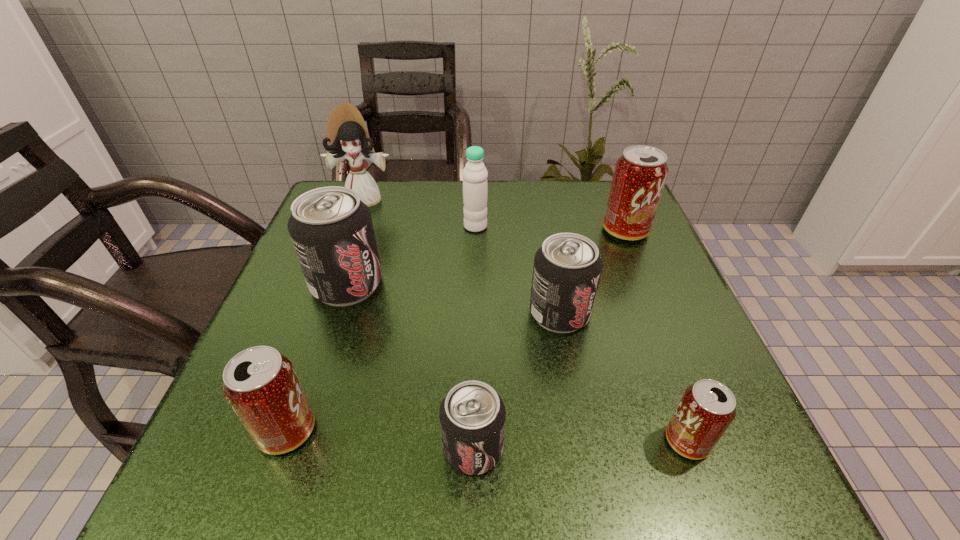
The width and height of the screenshot is (960, 540). Find the location of `free spot at the left edge of the desktop`. free spot at the left edge of the desktop is located at coordinates (209, 432).

In the image, there is a desktop. What are the coordinates of `blank space at the right edge` in the screenshot? It's located at (749, 424).

You are a GUI agent. You are given a task and a screenshot of the screen. Output one action in this format:
    pyautogui.click(x=<x>, y=<y>)
    Task: Click on the free point between the smallest black soda can and the leftmost red soda can
    
    Given the screenshot: What is the action you would take?
    pyautogui.click(x=380, y=440)

The height and width of the screenshot is (540, 960). Identify the location of free space that is in between the white water bottle and the fourth soda can from left to right. (517, 270).

Find the location of a particular element. free spot between the smallest red soda can and the second black soda can from left to right is located at coordinates (580, 444).

The height and width of the screenshot is (540, 960). Identify the location of free space between the doll and the farthest soda can. (495, 215).

Image resolution: width=960 pixels, height=540 pixels. I want to click on vacant space that is in between the farthest object and the farthest soda can, so click(x=495, y=215).

The width and height of the screenshot is (960, 540). I want to click on vacant point located between the smallest red soda can and the biggest black soda can, so pyautogui.click(x=517, y=363).

Image resolution: width=960 pixels, height=540 pixels. I want to click on unoccupied area between the second smallest black soda can and the water bottle, so click(x=517, y=270).

I want to click on blank region between the farthest soda can and the farthest object, so click(x=495, y=215).